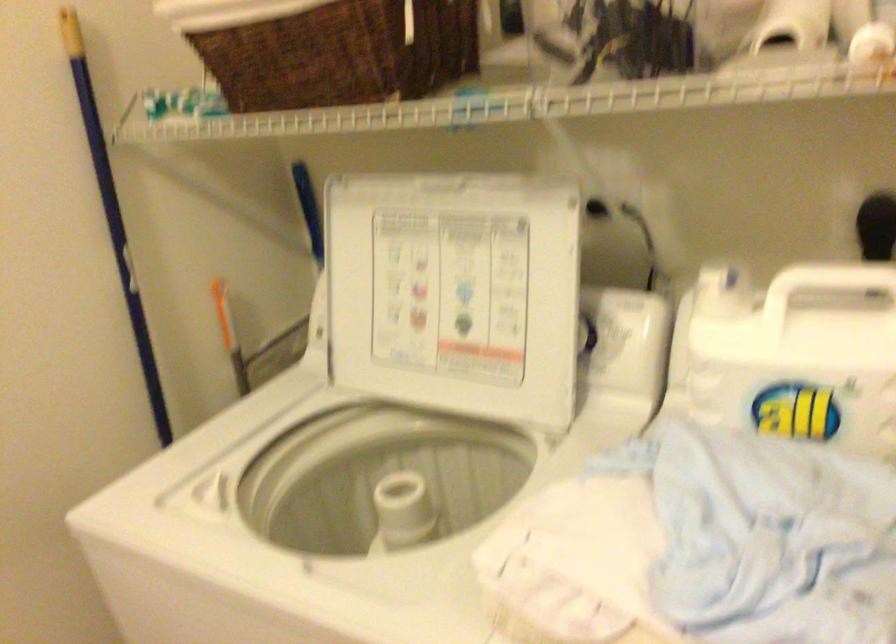
Find the location of `white bottle handle`. white bottle handle is located at coordinates (804, 288).